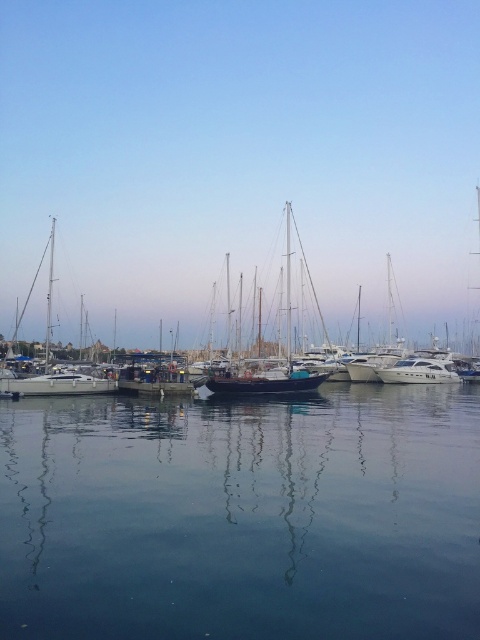
Question: Which object is positioned closest to the white glossy sailboat at left?

Choices:
 (A) white glossy yacht at center
 (B) wooden sailboat at center
 (C) clear blue water at center

Answer: (C)

Question: Is dark blue wooden sailboat at center positioned before wooden sailboat at center?

Choices:
 (A) yes
 (B) no

Answer: (A)

Question: Estimate the real-world distances between objects in this image. Which object is farther from the dark blue wooden sailboat at center?

Choices:
 (A) white glossy yacht at center
 (B) wooden sailboat at center

Answer: (B)

Question: Is clear blue water at center closer to camera compared to white glossy sailboat at left?

Choices:
 (A) no
 (B) yes

Answer: (B)

Question: Which of the following is the closest to the observer?

Choices:
 (A) white glossy sailboat at left
 (B) dark blue wooden sailboat at center

Answer: (A)

Question: Is the position of wooden sailboat at center less distant than that of white glossy yacht at center?

Choices:
 (A) yes
 (B) no

Answer: (A)